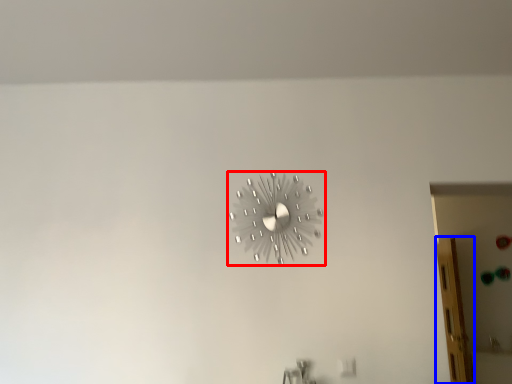
Question: Among these objects, which one is farthest to the camera, wall clock (highlighted by a red box) or glass door (highlighted by a blue box)?

Choices:
 (A) wall clock
 (B) glass door

Answer: (B)